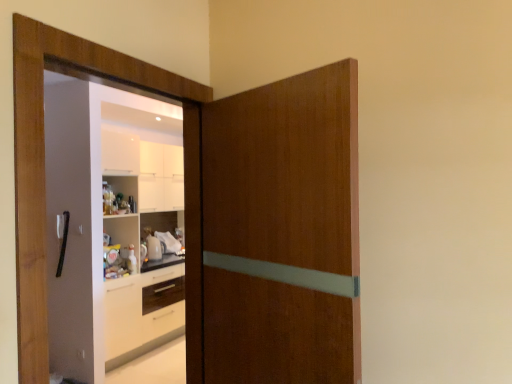
The width and height of the screenshot is (512, 384). Find the location of `wooden door at center`. wooden door at center is located at coordinates (274, 232).

What do you see at coordinates (80, 229) in the screenshot? I see `black plastic door handle at left` at bounding box center [80, 229].

You are a GUI agent. You are given a task and a screenshot of the screen. Output one action in this format:
    pyautogui.click(x=<x>, y=<y>)
    Task: Click on the wooden door at center
    Image resolution: width=512 pixels, height=384 pixels.
    Given the screenshot: What is the action you would take?
    pyautogui.click(x=274, y=232)

Relative to wooden door at center, is wooden screen door at left in front or behind?

Clearly, wooden screen door at left is in front of wooden door at center.

Which point is more distant from viewer, (144, 150) or (276, 289)?

Positioned behind is point (144, 150).

Does wooden screen door at left appear on the left side of wooden door at center?

Indeed, wooden screen door at left is positioned on the left side of wooden door at center.

From the image's perspective, which one is positioned higher, wooden screen door at left or wooden door at center?

wooden screen door at left appears higher in the image.

Is wooden door at center located within black plastic door handle at left?

No, wooden door at center is not a part of black plastic door handle at left.

Measure the distance between black plastic door handle at left and wooden door at center.

black plastic door handle at left and wooden door at center are 2.59 meters apart.

Identify the location of door above the black plastic door handle at left (from the image's perspective). (274, 232).

Can you confirm if black plastic door handle at left is smaller than wooden door at center?

Indeed, black plastic door handle at left has a smaller size compared to wooden door at center.

Can you confirm if black plastic door handle at left is thinner than wooden screen door at left?

Yes.

From the image's perspective, is black plastic door handle at left above wooden screen door at left?

No, from the image's perspective, black plastic door handle at left is not above wooden screen door at left.

Are black plastic door handle at left and wooden screen door at left making contact?

black plastic door handle at left and wooden screen door at left are clearly separated.

Considering the relative positions of black plastic door handle at left and wooden screen door at left in the image provided, is black plastic door handle at left to the left or to the right of wooden screen door at left?

Based on their positions, black plastic door handle at left is located to the left of wooden screen door at left.

Considering the positions of objects wooden door at center and wooden screen door at left in the image provided, who is more to the left, wooden door at center or wooden screen door at left?

wooden screen door at left.

Which object is closer to the camera taking this photo, wooden door at center or wooden screen door at left?

wooden screen door at left is closer to the camera.

Is wooden door at center positioned beyond the bounds of wooden screen door at left?

wooden door at center lies outside wooden screen door at left's area.

Can you confirm if wooden door at center is bigger than wooden screen door at left?

Yes.

Can black plastic door handle at left be found inside wooden door at center?

Definitely not — black plastic door handle at left is not inside wooden door at center.

In the image, is wooden door at center on the left side or the right side of black plastic door handle at left?

In the image, wooden door at center appears on the right side of black plastic door handle at left.

Is wooden door at center aimed at black plastic door handle at left?

No, wooden door at center is not aimed at black plastic door handle at left.

Is wooden screen door at left wider or thinner than black plastic door handle at left?

Considering their sizes, wooden screen door at left looks broader than black plastic door handle at left.

Is wooden screen door at left oriented away from black plastic door handle at left?

No, wooden screen door at left is not facing away from black plastic door handle at left.

Which object is closer to the camera, wooden screen door at left or black plastic door handle at left?

wooden screen door at left is more forward.

This screenshot has width=512, height=384. What are the coordinates of `door that appears below the wooden screen door at left (from a real-world perspective)` in the screenshot? It's located at (274, 232).

Locate an element on the screen. The image size is (512, 384). door handle below the wooden door at center (from the image's perspective) is located at coordinates (80, 229).

Which object lies further to the anchor point black plastic door handle at left, wooden screen door at left or wooden door at center?

wooden door at center is further to black plastic door handle at left.

From the image, which object appears to be nearer to wooden door at center, wooden screen door at left or black plastic door handle at left?

wooden screen door at left is positioned closer to the anchor wooden door at center.

Based on their spatial positions, is black plastic door handle at left or wooden screen door at left closer to wooden door at center?

wooden screen door at left lies closer to wooden door at center than the other object.

Looking at this image, from the image, which object appears to be farther from black plastic door handle at left, wooden door at center or wooden screen door at left?

wooden door at center is positioned further to the anchor black plastic door handle at left.

Considering their positions, is black plastic door handle at left positioned further to wooden screen door at left than wooden door at center?

Based on the image, wooden door at center appears to be further to wooden screen door at left.

Estimate the real-world distances between objects in this image. Which object is closer to wooden screen door at left, wooden door at center or black plastic door handle at left?

black plastic door handle at left is closer to wooden screen door at left.

Locate an element on the screen. door located between wooden screen door at left and black plastic door handle at left in the depth direction is located at coordinates (274, 232).